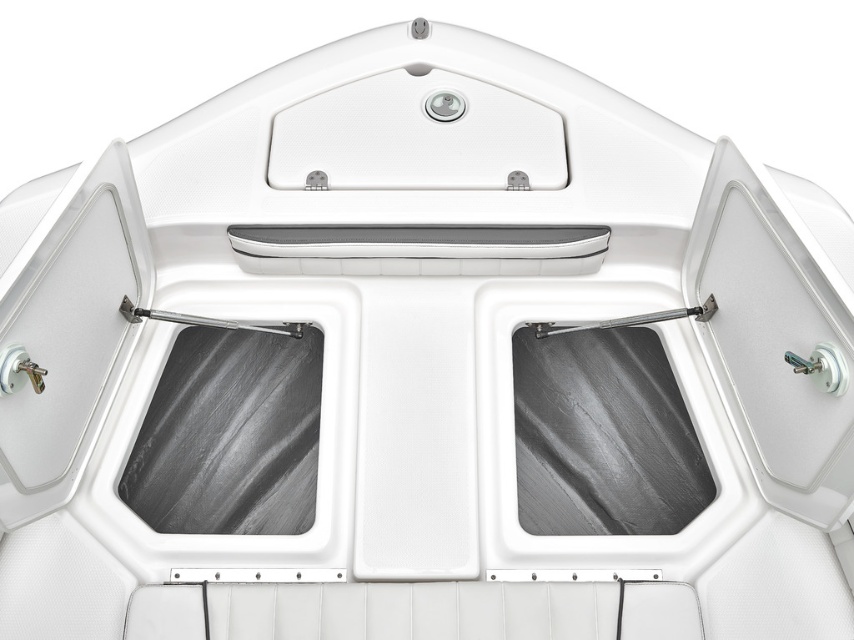
Question: From the image, what is the correct spatial relationship of black textured window at center in relation to satin black window at center?

Choices:
 (A) right
 (B) left

Answer: (B)

Question: Is black textured window at center bigger than satin black window at center?

Choices:
 (A) yes
 (B) no

Answer: (B)

Question: Among these objects, which one is nearest to the camera?

Choices:
 (A) satin black window at center
 (B) black textured window at center

Answer: (B)

Question: Which object appears closest to the camera in this image?

Choices:
 (A) satin black window at center
 (B) black textured window at center

Answer: (B)

Question: Does black textured window at center appear over satin black window at center?

Choices:
 (A) no
 (B) yes

Answer: (B)